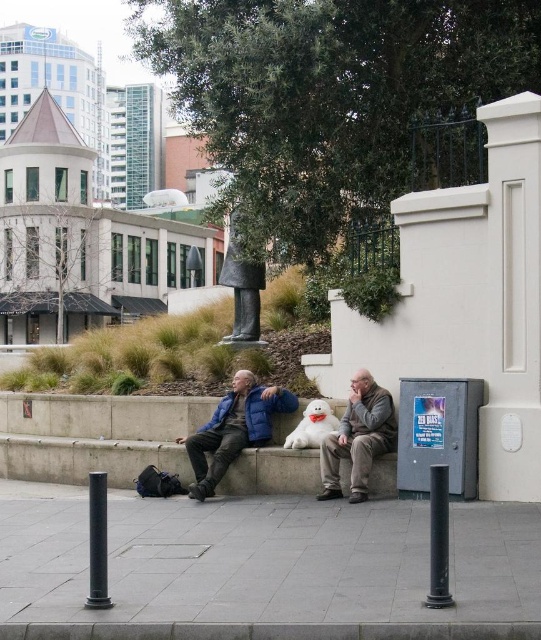
You are a delivery person trying to place a small package on the gray concrete pavement at lower center. However, there is a matte blue jacket at center in the way. Can you place the package on the pavement without moving the jacket?

The gray concrete pavement at lower center is thinner than the matte blue jacket at center, so there might not be enough space to place the package without overlapping the jacket.